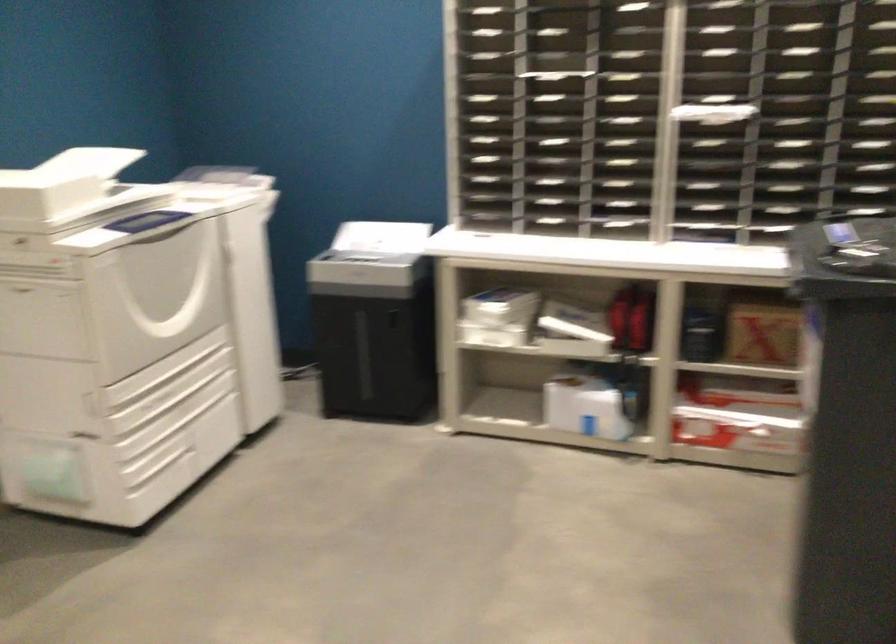
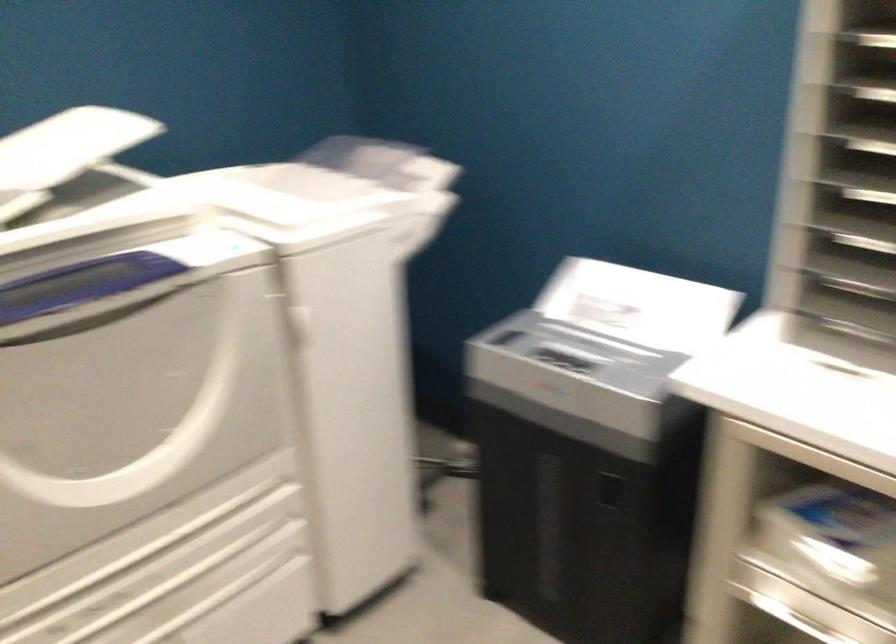
Question: Which direction would the cameraman need to move to produce the second image? Reply with the corresponding letter.

Choices:
 (A) Left
 (B) Right
 (C) Forward
 (D) Backward

Answer: (C)